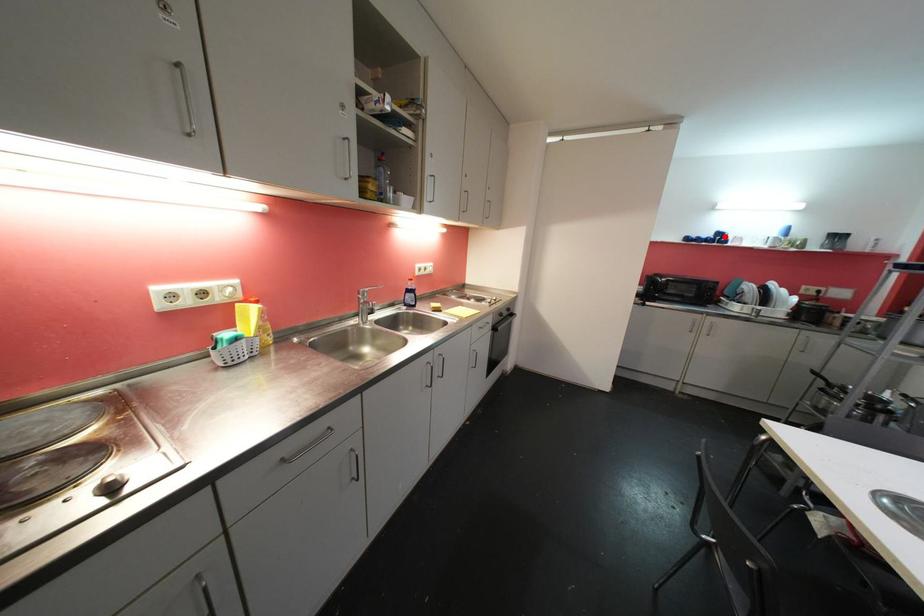
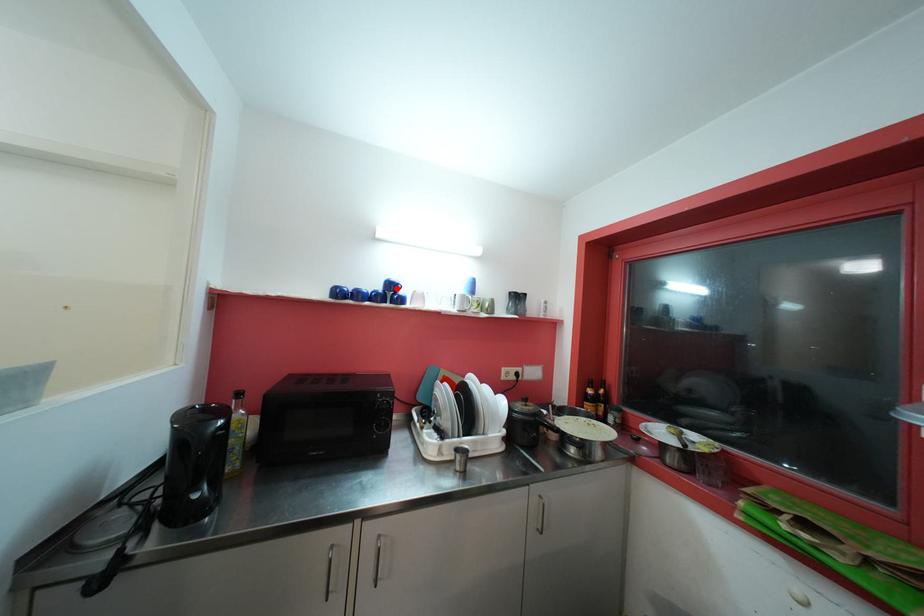
I am providing you with two images of the same scene from different viewpoints. A red point is marked on the first image and another point is marked on the second image. Is the marked point in image1 the same physical position as the marked point in image2?

Yes